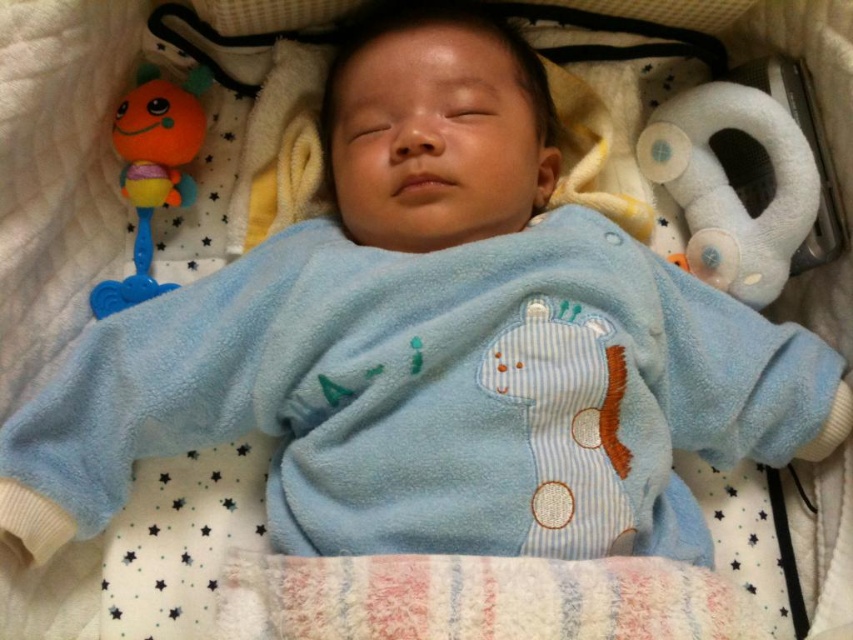
Is point (689, 188) less distant than point (172, 193)?

No, it is not.

Who is positioned more to the right, white plush teether at upper right or orange rubber rattle at upper left?

white plush teether at upper right

Is point (636, 144) farther from camera compared to point (132, 292)?

Yes, it is behind point (132, 292).

Locate an element on the screen. This screenshot has height=640, width=853. white plush teether at upper right is located at coordinates (730, 186).

Is smooth blue baby at center to the right of orange rubber rattle at upper left from the viewer's perspective?

Yes, smooth blue baby at center is to the right of orange rubber rattle at upper left.

Can you confirm if smooth blue baby at center is taller than orange rubber rattle at upper left?

No.

Measure the distance between smooth blue baby at center and camera.

smooth blue baby at center is 34.38 inches from camera.

This screenshot has height=640, width=853. What are the coordinates of `smooth blue baby at center` in the screenshot? It's located at (436, 129).

Between point (383, 17) and point (726, 108), which one is positioned behind?

The point (726, 108) is behind.

Can you confirm if smooth blue baby at center is bigger than white plush teether at upper right?

Correct, smooth blue baby at center is larger in size than white plush teether at upper right.

Is point (346, 88) positioned behind point (712, 198)?

No, (346, 88) is in front of (712, 198).

Locate an element on the screen. The height and width of the screenshot is (640, 853). smooth blue baby at center is located at coordinates (436, 129).